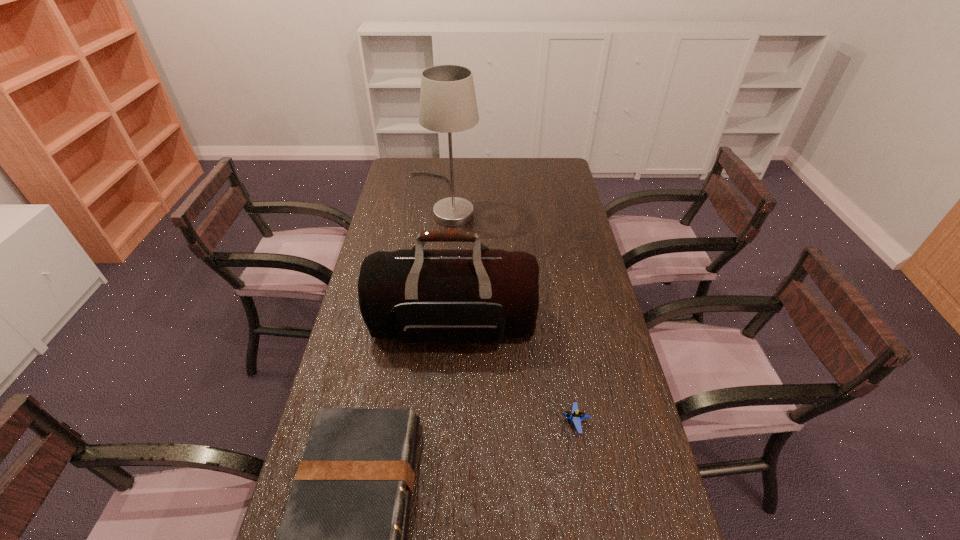
At what (x,y) coordinates should I click in order to perform the action: click on the second closest object to the duffel bag. Please return your answer as a coordinate pair (x, y). This screenshot has height=540, width=960. Looking at the image, I should click on (343, 539).

Identify which object is located as the third nearest to the hardback book. Please provide its 2D coordinates. Your answer should be formatted as a tuple, i.e. [(x, y)], where the tuple contains the x and y coordinates of a point satisfying the conditions above.

[(448, 104)]